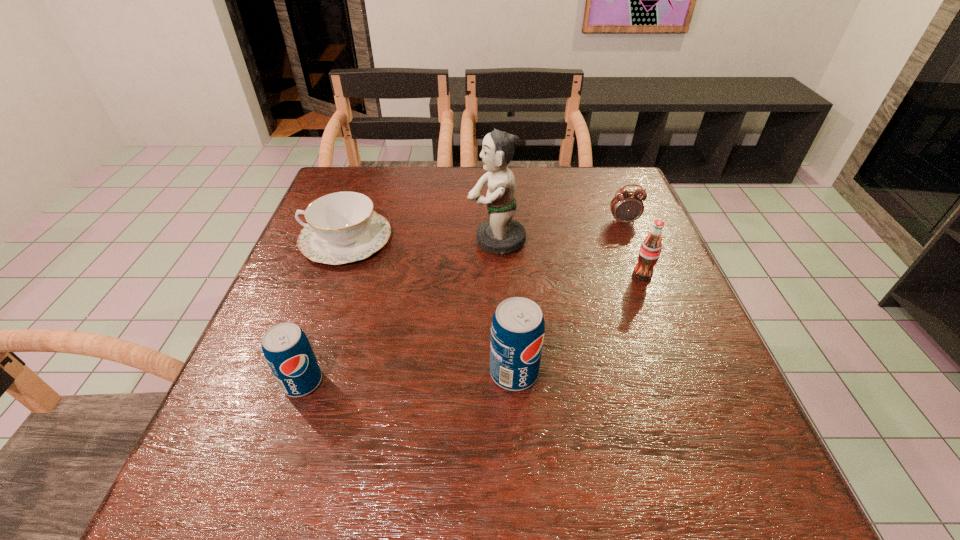
Please point a free position for a pop on the right. Please provide its 2D coordinates. Your answer should be formatted as a tuple, i.e. [(x, y)], where the tuple contains the x and y coordinates of a point satisfying the conditions above.

[(718, 363)]